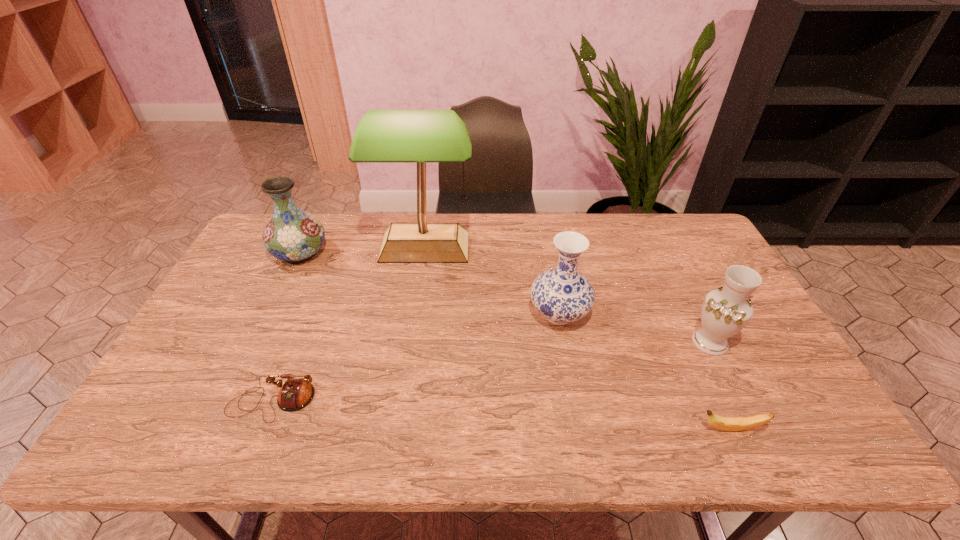
At what (x,y) coordinates should I click in order to perform the action: click on vase that can be found as the closest to the banana. Please return your answer as a coordinate pair (x, y). Looking at the image, I should click on (725, 311).

You are a GUI agent. You are given a task and a screenshot of the screen. Output one action in this format:
    pyautogui.click(x=<x>, y=<y>)
    Task: Click on the free location that satisfies the following two spatial constraints: 1. on the front side of the rightmost vase; 2. at the stem of the nearest object
    
    Given the screenshot: What is the action you would take?
    pyautogui.click(x=754, y=429)

At what (x,y) coordinates should I click in order to perform the action: click on vacant area that satisfies the following two spatial constraints: 1. on the metallic stand of the rightmost vase; 2. on the left side of the tallest object. Please return your answer as a coordinate pair (x, y). Image resolution: width=960 pixels, height=540 pixels. Looking at the image, I should click on (411, 342).